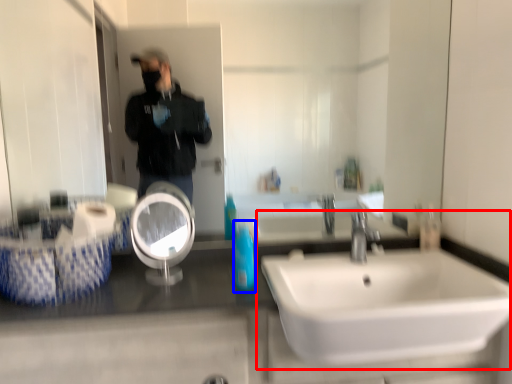
Question: Which object appears closest to the camera in this image, sink (highlighted by a red box) or mouthwash (highlighted by a blue box)?

Choices:
 (A) sink
 (B) mouthwash

Answer: (A)